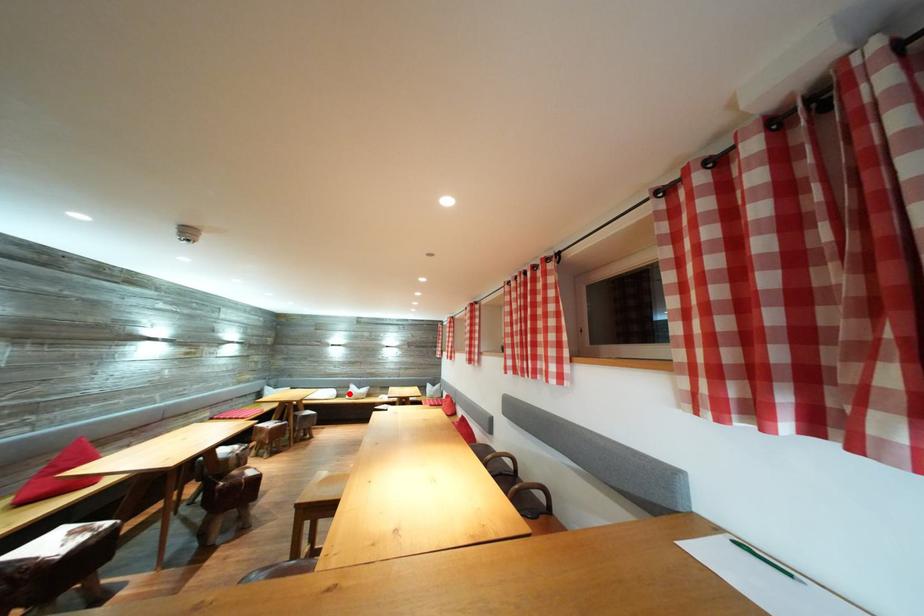
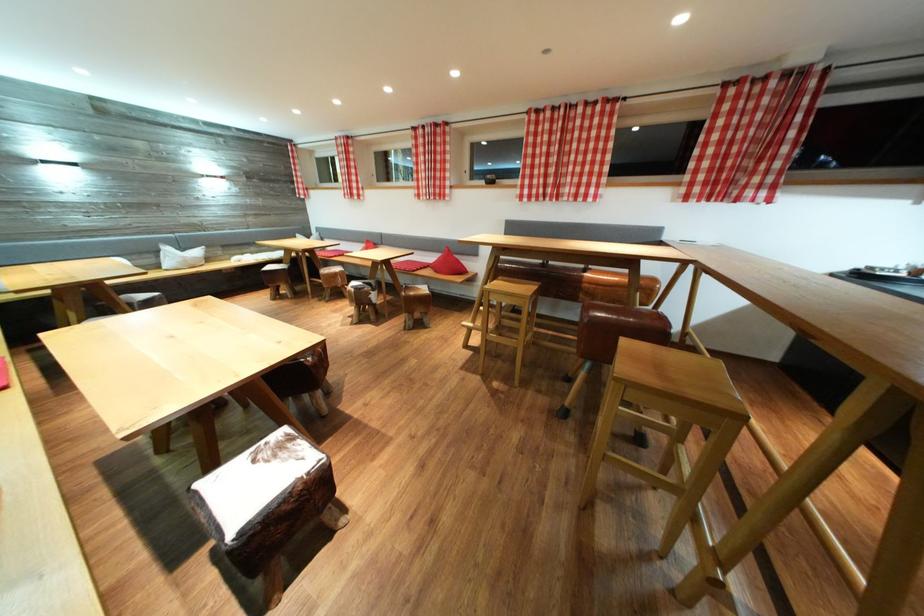
Find the pixel in the second image that matches the highlighted location in the first image.

(151, 259)